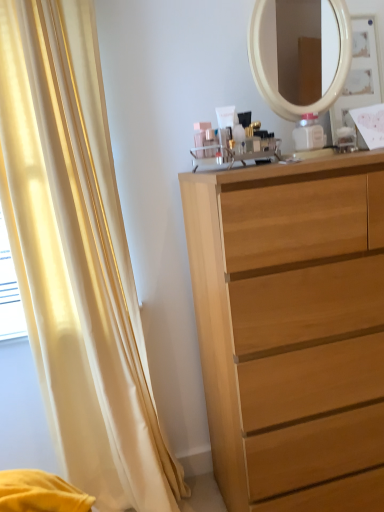
Question: From the image's perspective, relative to light wood chest of drawers at center, is silky yellow curtain at left above or below?

Choices:
 (A) below
 (B) above

Answer: (B)

Question: Looking at their shapes, would you say silky yellow curtain at left is wider or thinner than light wood chest of drawers at center?

Choices:
 (A) wide
 (B) thin

Answer: (B)

Question: Based on their sizes in the image, would you say silky yellow curtain at left is bigger or smaller than light wood chest of drawers at center?

Choices:
 (A) big
 (B) small

Answer: (B)

Question: Is point (374, 239) positioned closer to the camera than point (105, 206)?

Choices:
 (A) farther
 (B) closer

Answer: (B)

Question: Do you think light wood chest of drawers at center is within silky yellow curtain at left, or outside of it?

Choices:
 (A) inside
 (B) outside

Answer: (B)

Question: From the image's perspective, is light wood chest of drawers at center located above or below silky yellow curtain at left?

Choices:
 (A) above
 (B) below

Answer: (B)

Question: From a real-world perspective, is light wood chest of drawers at center positioned above or below silky yellow curtain at left?

Choices:
 (A) above
 (B) below

Answer: (B)